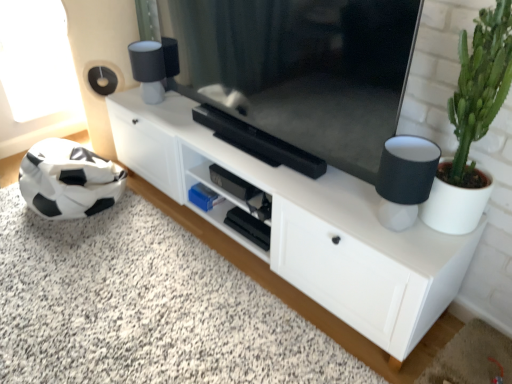
Question: Considering the relative sizes of white matte cabinet at center and black fabric lampshade at right in the image provided, is white matte cabinet at center thinner than black fabric lampshade at right?

Choices:
 (A) yes
 (B) no

Answer: (B)

Question: From a real-world perspective, is white matte cabinet at center located higher than black fabric lampshade at right?

Choices:
 (A) no
 (B) yes

Answer: (A)

Question: Is white matte cabinet at center taller than black fabric lampshade at right?

Choices:
 (A) no
 (B) yes

Answer: (B)

Question: From the image's perspective, is white matte cabinet at center located above black fabric lampshade at right?

Choices:
 (A) no
 (B) yes

Answer: (A)

Question: Is white matte cabinet at center in contact with black fabric lampshade at right?

Choices:
 (A) yes
 (B) no

Answer: (B)

Question: Is white matte cabinet at center turned away from black fabric lampshade at right?

Choices:
 (A) no
 (B) yes

Answer: (A)

Question: From a real-world perspective, is green succulent at right beneath black fabric lampshade at right?

Choices:
 (A) no
 (B) yes

Answer: (A)

Question: From the image's perspective, is green succulent at right under black fabric lampshade at right?

Choices:
 (A) yes
 (B) no

Answer: (B)

Question: Does green succulent at right appear on the right side of black fabric lampshade at right?

Choices:
 (A) no
 (B) yes

Answer: (B)

Question: Considering the relative sizes of green succulent at right and black fabric lampshade at right in the image provided, is green succulent at right taller than black fabric lampshade at right?

Choices:
 (A) yes
 (B) no

Answer: (A)

Question: Does green succulent at right have a lesser width compared to black fabric lampshade at right?

Choices:
 (A) no
 (B) yes

Answer: (A)

Question: Is the surface of green succulent at right in direct contact with black fabric lampshade at right?

Choices:
 (A) yes
 (B) no

Answer: (B)

Question: Is green succulent at right further to the viewer compared to black matte soccer ball at lower left?

Choices:
 (A) no
 (B) yes

Answer: (B)